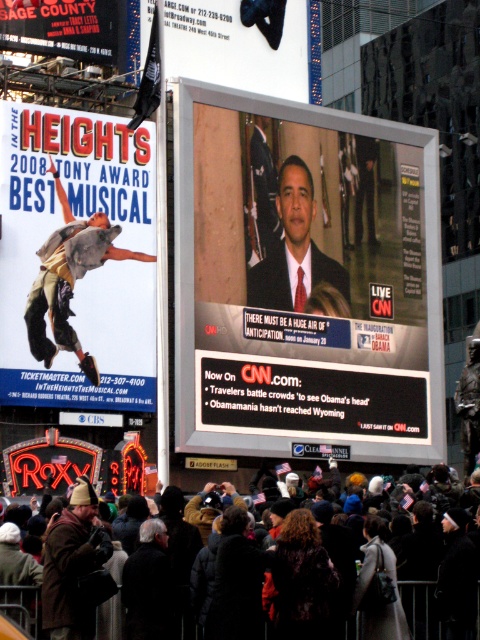
You are a delivery person needing to place a 100 foot long banner between the shiny silver tv at center and the brown woolen hat at center. Based on the scene, will the banner be too long or just right?

The distance between the shiny silver tv at center and the brown woolen hat at center is 77.32 feet. Since the banner is 100 feet long, it will be too long.

You are a photographer trying to capture both the shiny silver tv at center and the matte black suit at center in a single frame. Based on their sizes, which object should you focus on first to ensure both fit in the photo?

The shiny silver tv at center is wider than the matte black suit at center, so you should focus on framing the wider TV first to ensure both objects fit in the photo.

In the scene shown: You are a photographer standing in the crowd at the event in Times Square. You want to take a photo that includes both the point at coordinates point [4,180] and point [303,282]. Since you can only focus on one point at a time, which point should you focus on to ensure the other point remains in the background?

You should focus on point [4,180] because it is in front of point [303,282]. By focusing on the closer point, the farther point will naturally be in the background of the photo.